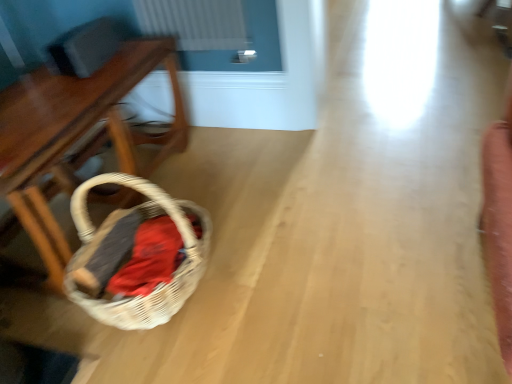
Where is `wooden table at left`? The height and width of the screenshot is (384, 512). wooden table at left is located at coordinates (77, 135).

Describe the element at coordinates (77, 135) in the screenshot. I see `wooden table at left` at that location.

I want to click on wooden table at left, so (77, 135).